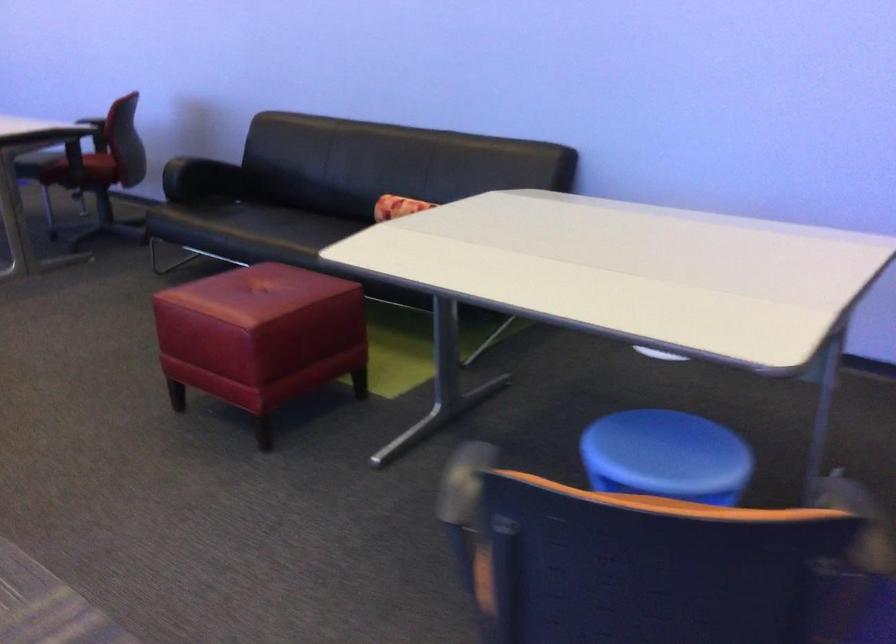
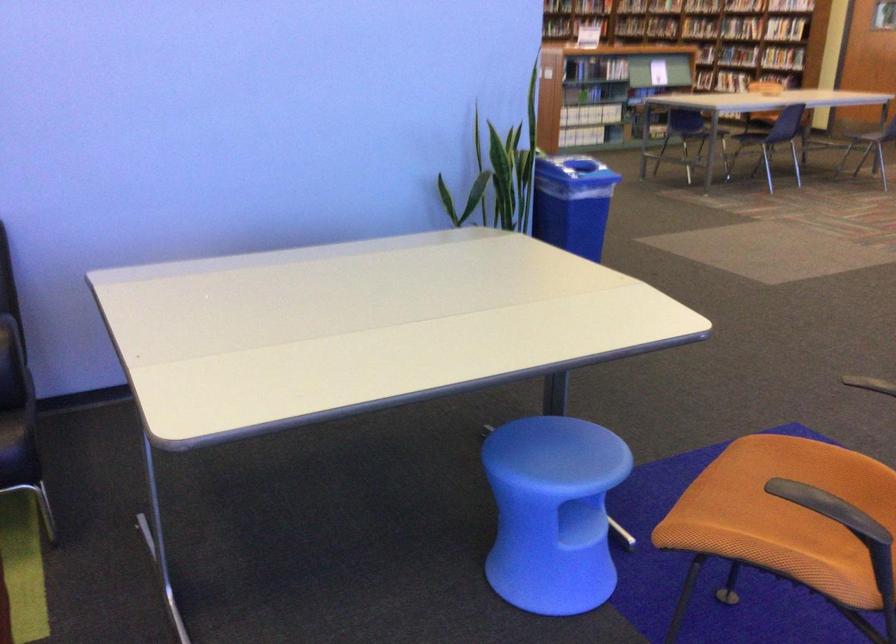
Find the pixel in the second image that matches [596,485] in the first image.

(553, 512)